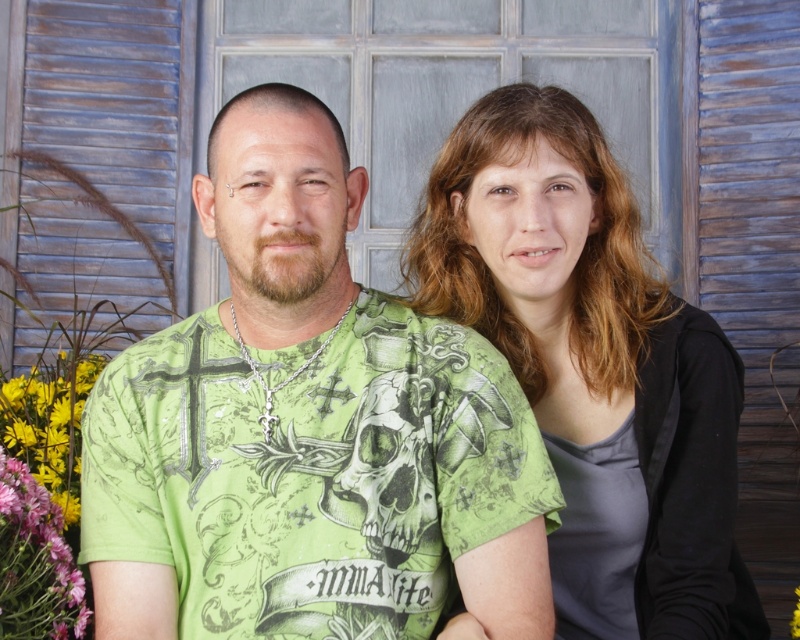
Can you confirm if green printed t-shirt at center is smaller than pink fabric at lower left?

No.

Find the location of a particular element. green printed t-shirt at center is located at coordinates (308, 429).

In the scene shown: Is matte green shirt at center bigger than pink fabric at lower left?

Yes, matte green shirt at center is bigger than pink fabric at lower left.

Does matte green shirt at center have a smaller size compared to pink fabric at lower left?

No.

Who is more distant from viewer, (x=592, y=426) or (x=2, y=582)?

The point (x=592, y=426) is more distant.

I want to click on matte green shirt at center, so click(594, 365).

Which is more to the left, green printed t-shirt at center or matte green shirt at center?

green printed t-shirt at center

Looking at this image, between green printed t-shirt at center and matte green shirt at center, which one has less height?

green printed t-shirt at center

Who is more distant from viewer, (416,412) or (701,438)?

The point (701,438) is more distant.

Image resolution: width=800 pixels, height=640 pixels. Identify the location of green printed t-shirt at center. (308, 429).